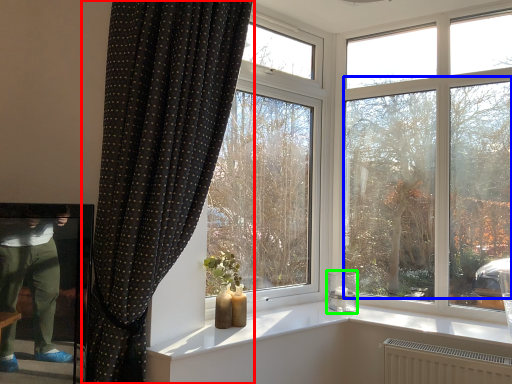
Question: Which is nearer to the curtain (highlighted by a red box)? tree (highlighted by a blue box) or candle holder (highlighted by a green box).

Choices:
 (A) tree
 (B) candle holder

Answer: (A)